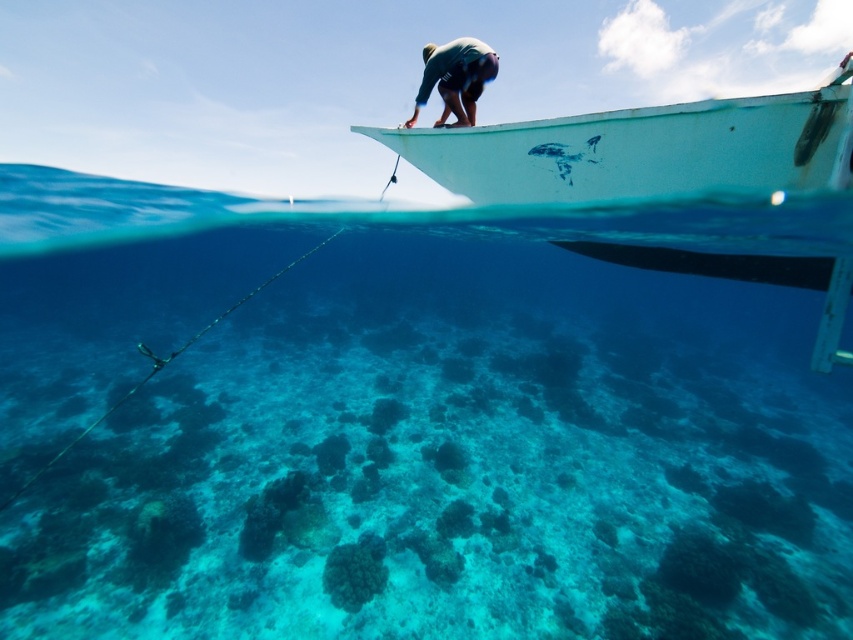
Question: Is clear blue water at center below white matte boat at upper right?

Choices:
 (A) no
 (B) yes

Answer: (A)

Question: Among these objects, which one is nearest to the camera?

Choices:
 (A) dark green wetsuit at upper center
 (B) white matte boat at upper right

Answer: (B)

Question: Which of the following is the closest to the observer?

Choices:
 (A) dark green wetsuit at upper center
 (B) white matte boat at upper right

Answer: (B)

Question: Can you confirm if clear blue water at center is positioned below white matte boat at upper right?

Choices:
 (A) yes
 (B) no

Answer: (B)

Question: Which point is farther from the camera taking this photo?

Choices:
 (A) (390, 141)
 (B) (422, 99)
 (C) (479, 621)

Answer: (B)

Question: Can you confirm if clear blue water at center is positioned below white matte boat at upper right?

Choices:
 (A) yes
 (B) no

Answer: (B)